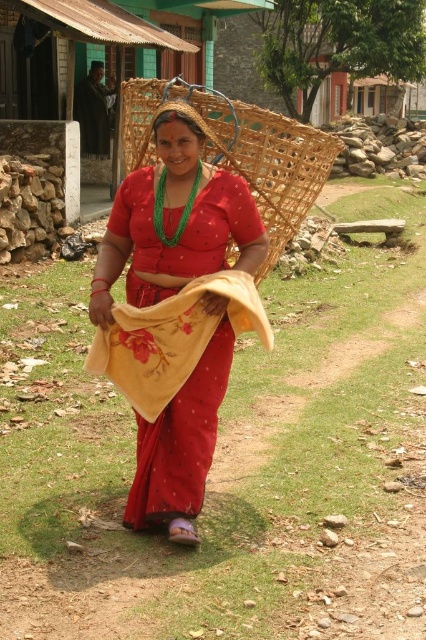
How far apart are matte red saree at center and woven bamboo basket at center?

matte red saree at center is 3.53 feet from woven bamboo basket at center.

Looking at this image, is matte red saree at center positioned in front of woven bamboo basket at center?

Yes.

Locate an element on the screen. matte red saree at center is located at coordinates pyautogui.click(x=175, y=316).

Between woven bamboo basket at center and floral yellow towel at center, which one is positioned lower?

Positioned lower is floral yellow towel at center.

Who is higher up, woven bamboo basket at center or floral yellow towel at center?

woven bamboo basket at center is above.

The width and height of the screenshot is (426, 640). Describe the element at coordinates (238, 148) in the screenshot. I see `woven bamboo basket at center` at that location.

You are a GUI agent. You are given a task and a screenshot of the screen. Output one action in this format:
    pyautogui.click(x=<x>, y=<y>)
    Task: Click on the woven bamboo basket at center
    The width and height of the screenshot is (426, 640).
    Given the screenshot: What is the action you would take?
    pyautogui.click(x=238, y=148)

Is matte red saree at center positioned in front of floral yellow towel at center?

That is False.

How far apart are matte red saree at center and floral yellow towel at center?

matte red saree at center is 4.58 inches away from floral yellow towel at center.

Is point (175, 243) positioned behind point (158, 380)?

No, (175, 243) is closer to viewer.

At what (x,y) coordinates should I click in order to perform the action: click on matte red saree at center. Please return your answer as a coordinate pair (x, y). Looking at the image, I should click on (175, 316).